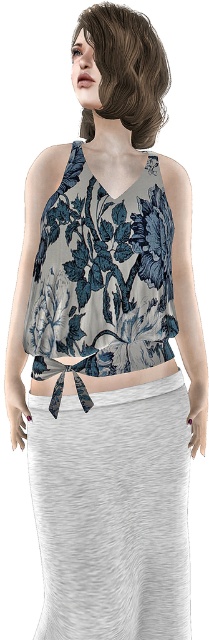
Based on the photo, you are standing in front of the person wearing the floral top and gray skirt. There are two points marked on their outfit. One is at coordinate point (128, 72) and the other at point (72, 384). Which point is closer to you?

Point (128, 72) is in front of point (72, 384), so the point at (128, 72) is closer to you.

You are a fashion designer observing the outfit. You need to determine the spatial relationship between the brown matte hair at upper center and the floral fabric top at center. Which object is located to the right of the other?

The brown matte hair at upper center is positioned on the right side of floral fabric top at center.